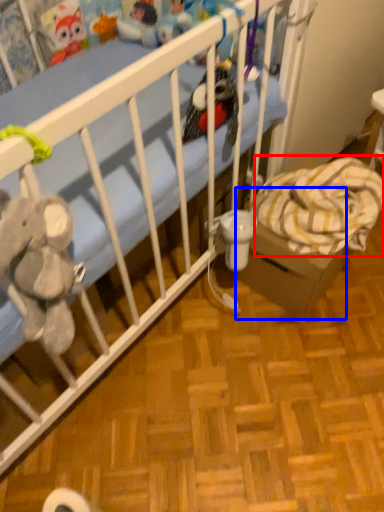
Question: Which point is closer to the camera, blanket (highlighted by a red box) or cardboard box (highlighted by a blue box)?

Choices:
 (A) blanket
 (B) cardboard box

Answer: (A)